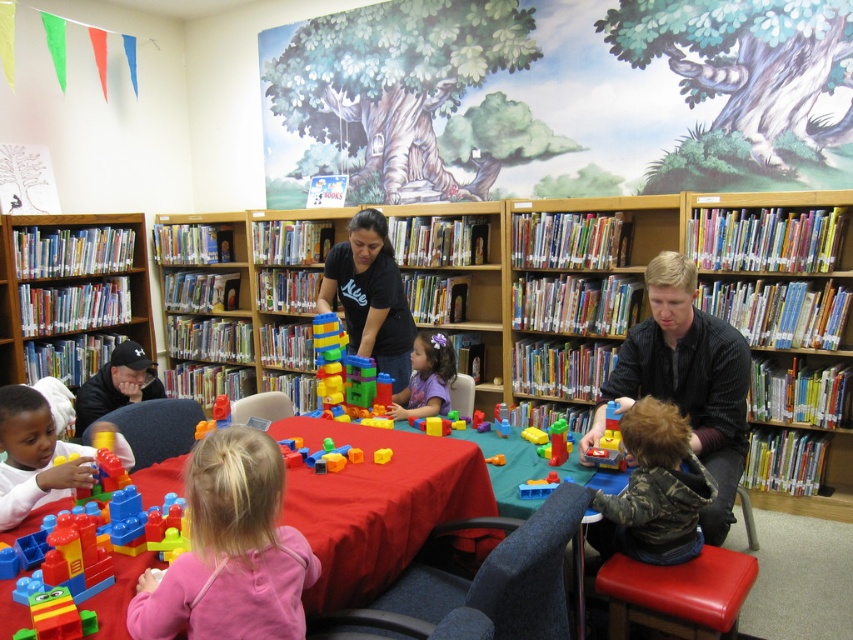
You are a child sitting at the table in the children library scene. You want to build a tower using the matte plastic blocks at lower left and the translucent plastic blocks at center. Which set of blocks should you reach for first if you want to start with the ones closer to you?

The matte plastic blocks at lower left are to the left of the translucent plastic blocks at center, so if you are sitting at the table, the matte plastic blocks at lower left are closer to you and should be reached for first.

You are standing in the children library and want to take a photo of the two points mentioned. Which point, point (683,451) or point (410,403), will appear larger in your camera view?

Point (683,451) is closer to the camera than point (410,403), so it will appear larger in the camera view.

You are a teacher organizing a classroom activity. You have two types of blocks available for the children to use. The matte plastic blocks at lower left and the translucent plastic blocks at center. Which set of blocks is larger in size?

The matte plastic blocks at lower left is bigger than the translucent plastic blocks at center, so the matte plastic blocks at lower left are larger in size.